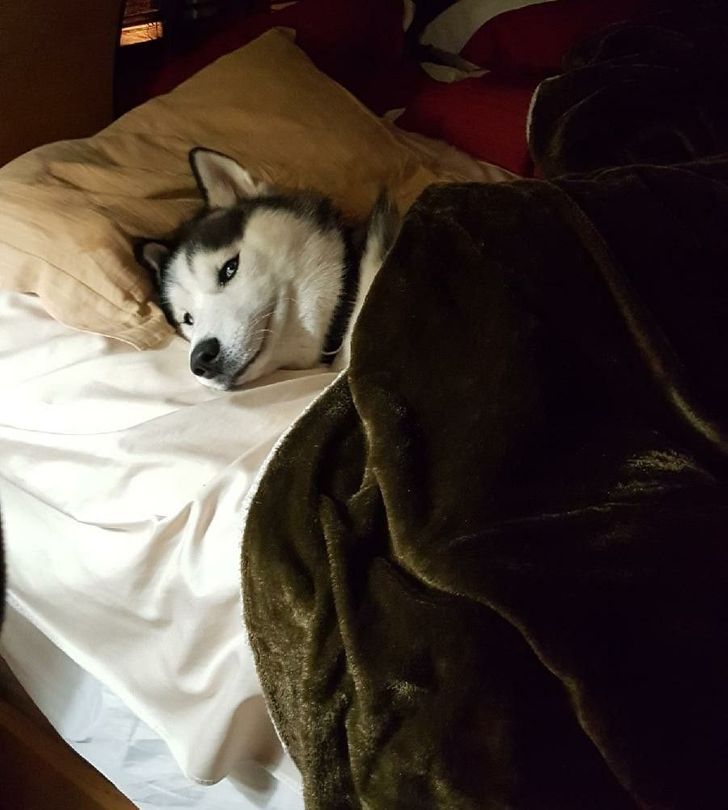
Identify the location of white fur. This screenshot has height=810, width=728. (272, 231), (205, 310), (298, 292), (364, 279).